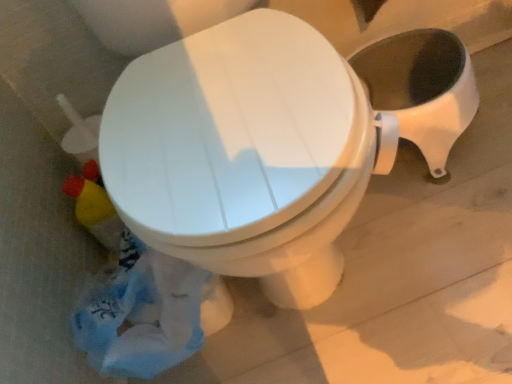
Describe the element at coordinates (243, 152) in the screenshot. I see `white glossy toilet at center` at that location.

At what (x,y) coordinates should I click in order to perform the action: click on white glossy toilet at center. Please return your answer as a coordinate pair (x, y). This screenshot has height=384, width=512. Looking at the image, I should click on (243, 152).

Locate an element on the screen. Image resolution: width=512 pixels, height=384 pixels. blue plastic bag at lower left is located at coordinates (140, 296).

What do you see at coordinates (140, 296) in the screenshot? I see `blue plastic bag at lower left` at bounding box center [140, 296].

Locate an element on the screen. white glossy toilet at center is located at coordinates (243, 152).

Which object is positioned more to the right, white glossy toilet at center or blue plastic bag at lower left?

white glossy toilet at center.

Between white glossy toilet at center and blue plastic bag at lower left, which one is positioned in front?

blue plastic bag at lower left is more forward.

Does point (359, 89) lie behind point (196, 275)?

No, (359, 89) is closer to viewer.

From the image's perspective, is white glossy toilet at center beneath blue plastic bag at lower left?

No.

From a real-world perspective, is white glossy toilet at center below blue plastic bag at lower left?

Yes, from a real-world perspective, white glossy toilet at center is under blue plastic bag at lower left.

From the picture: Can you confirm if white glossy toilet at center is thinner than blue plastic bag at lower left?

Incorrect, the width of white glossy toilet at center is not less than that of blue plastic bag at lower left.

Is white glossy toilet at center taller than blue plastic bag at lower left?

No.

Is white glossy toilet at center smaller than blue plastic bag at lower left?

Actually, white glossy toilet at center might be larger than blue plastic bag at lower left.

Is white glossy toilet at center not inside blue plastic bag at lower left?

Absolutely, white glossy toilet at center is external to blue plastic bag at lower left.

Is white glossy toilet at center with blue plastic bag at lower left?

No, white glossy toilet at center is not making contact with blue plastic bag at lower left.

Is white glossy toilet at center aimed at blue plastic bag at lower left?

No, white glossy toilet at center does not turn towards blue plastic bag at lower left.

How different are the orientations of white glossy toilet at center and blue plastic bag at lower left in degrees?

white glossy toilet at center and blue plastic bag at lower left are facing 0.305 degrees away from each other.

Measure the distance from white glossy toilet at center to blue plastic bag at lower left.

white glossy toilet at center is 11.61 inches away from blue plastic bag at lower left.

You are a GUI agent. You are given a task and a screenshot of the screen. Output one action in this format:
    pyautogui.click(x=<x>, y=<y>)
    Task: Click on the garbage on the left of white glossy toilet at center
    The image size is (512, 384).
    Given the screenshot: What is the action you would take?
    pyautogui.click(x=140, y=296)

In the image, is blue plastic bag at lower left on the left side or the right side of white glossy toilet at center?

Based on their positions, blue plastic bag at lower left is located to the left of white glossy toilet at center.

Is the position of blue plastic bag at lower left less distant than that of white glossy toilet at center?

Yes, blue plastic bag at lower left is in front of white glossy toilet at center.

Between point (83, 183) and point (270, 223), which one is positioned in front?

The point (270, 223) is closer to the camera.

From the image's perspective, is blue plastic bag at lower left positioned above or below white glossy toilet at center?

Based on their image positions, blue plastic bag at lower left is located beneath white glossy toilet at center.

From a real-world perspective, who is located higher, blue plastic bag at lower left or white glossy toilet at center?

In real-world perspective, blue plastic bag at lower left is above.

Which of these two, blue plastic bag at lower left or white glossy toilet at center, is thinner?

blue plastic bag at lower left is thinner.

From the picture: Can you confirm if blue plastic bag at lower left is taller than white glossy toilet at center?

Yes.

Between blue plastic bag at lower left and white glossy toilet at center, which one has larger size?

Bigger between the two is white glossy toilet at center.

Do you think blue plastic bag at lower left is within white glossy toilet at center, or outside of it?

blue plastic bag at lower left is not inside white glossy toilet at center, it's outside.

Does blue plastic bag at lower left touch white glossy toilet at center?

No, blue plastic bag at lower left is not in contact with white glossy toilet at center.

Could you tell me if blue plastic bag at lower left is facing white glossy toilet at center?

No.

How many degrees apart are the facing directions of blue plastic bag at lower left and white glossy toilet at center?

blue plastic bag at lower left and white glossy toilet at center are facing 0.305 degrees away from each other.

How much distance is there between blue plastic bag at lower left and white glossy toilet at center?

They are 11.61 inches apart.

At what (x,y) coordinates should I click in order to perform the action: click on garbage that appears above the white glossy toilet at center (from a real-world perspective). Please return your answer as a coordinate pair (x, y). Looking at the image, I should click on (140, 296).

The image size is (512, 384). I want to click on toilet directly beneath the blue plastic bag at lower left (from a real-world perspective), so click(243, 152).

I want to click on toilet behind the blue plastic bag at lower left, so click(243, 152).